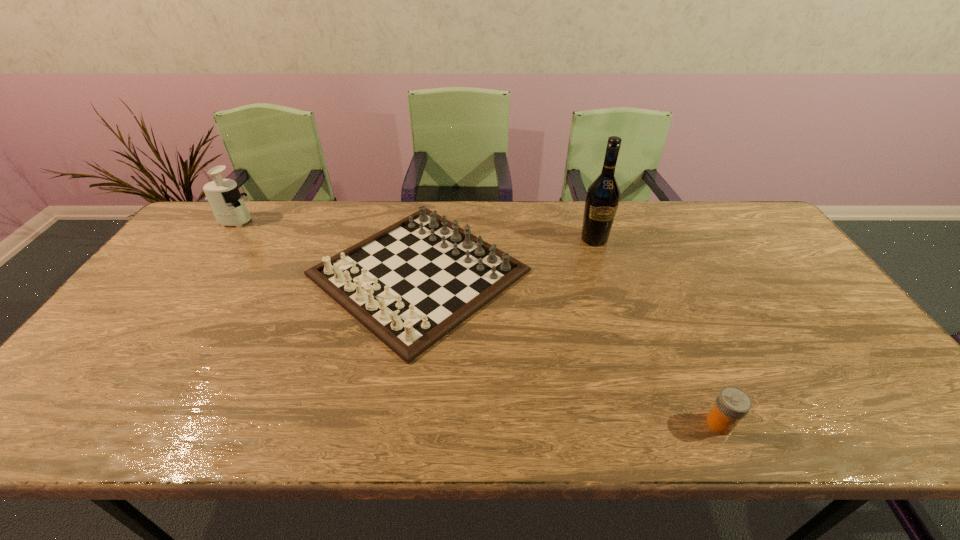
This screenshot has height=540, width=960. I want to click on wine bottle, so click(x=603, y=195).

The width and height of the screenshot is (960, 540). Find the location of `the tallest object`. the tallest object is located at coordinates (603, 195).

Where is `the leftmost object`? The height and width of the screenshot is (540, 960). the leftmost object is located at coordinates [x=227, y=204].

The image size is (960, 540). Identify the location of the second tallest object. (227, 204).

At what (x,y) coordinates should I click in order to perform the action: click on chessboard. Please return your answer as a coordinate pair (x, y). Image resolution: width=960 pixels, height=540 pixels. Looking at the image, I should click on (410, 284).

You are a GUI agent. You are given a task and a screenshot of the screen. Output one action in this format:
    pyautogui.click(x=<x>, y=<y>)
    Task: Click on the nearest object
    
    Given the screenshot: What is the action you would take?
    pyautogui.click(x=732, y=404)

Find the location of a particular element. medicine is located at coordinates [732, 404].

Find the location of `free space located on the label of the tallest object`. free space located on the label of the tallest object is located at coordinates (627, 342).

Find the location of a particular element. vacant space located on the front of the second tallest object is located at coordinates (195, 276).

Locate an element on the screen. vacant space located 0.060m on the left of the chessboard is located at coordinates (285, 273).